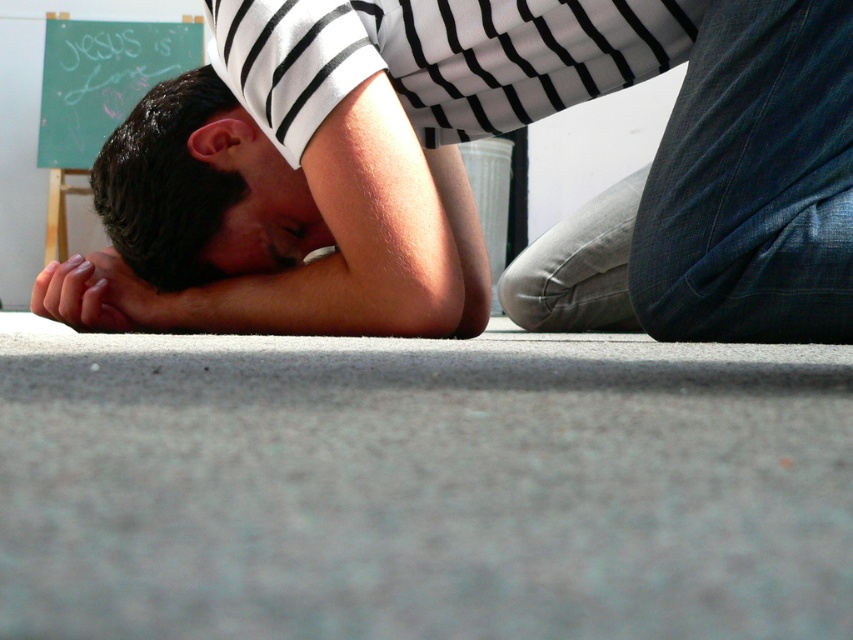
Is dark brown hair at center thinner than smooth skin hand at lower left?

No, dark brown hair at center is not thinner than smooth skin hand at lower left.

Measure the distance from dark brown hair at center to smooth skin hand at lower left.

dark brown hair at center is 4.68 inches from smooth skin hand at lower left.

At what (x,y) coordinates should I click in order to perform the action: click on dark brown hair at center. Please return your answer as a coordinate pair (x, y). Looking at the image, I should click on (166, 182).

In order to click on dark brown hair at center in this screenshot , I will do `click(166, 182)`.

Does dark brown hair at center come in front of smooth skin face at center?

Yes, it is.

Who is higher up, dark brown hair at center or smooth skin face at center?

dark brown hair at center

Based on the photo, measure the distance between dark brown hair at center and camera.

A distance of 3.93 feet exists between dark brown hair at center and camera.

Locate an element on the screen. This screenshot has width=853, height=640. dark brown hair at center is located at coordinates (166, 182).

Is point (782, 141) positioned in front of point (146, 272)?

Yes, it is.

Which of these two, matte black shirt at center or dark brown hair at center, stands taller?

matte black shirt at center

Where is `matte black shirt at center`? This screenshot has width=853, height=640. matte black shirt at center is located at coordinates (463, 170).

Where is `matte black shirt at center`? The height and width of the screenshot is (640, 853). matte black shirt at center is located at coordinates (463, 170).